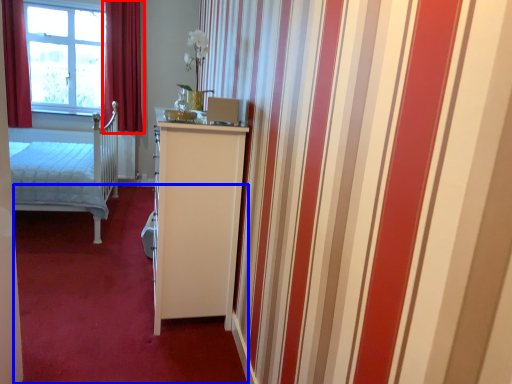
Question: Among these objects, which one is farthest to the camera, curtain (highlighted by a red box) or plain (highlighted by a blue box)?

Choices:
 (A) curtain
 (B) plain

Answer: (A)